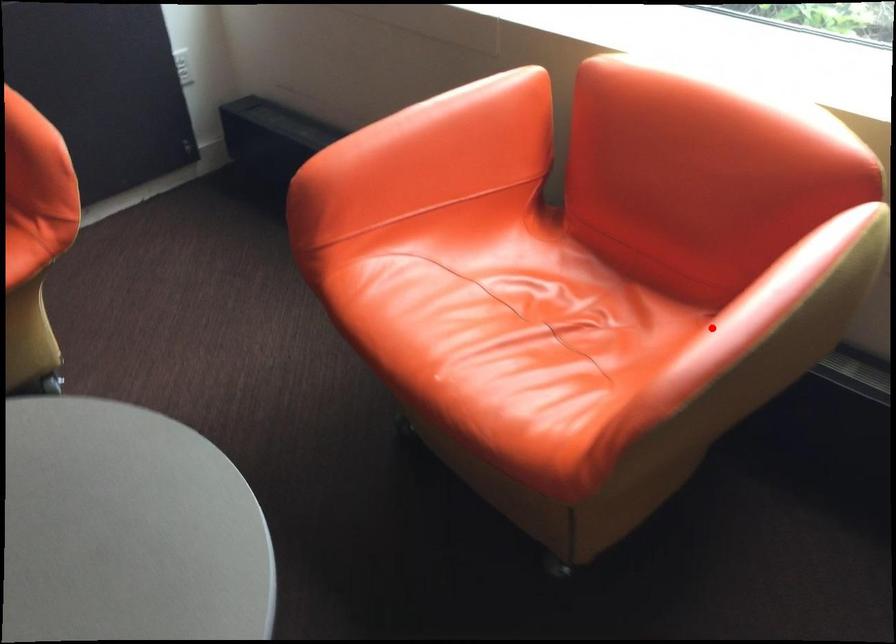
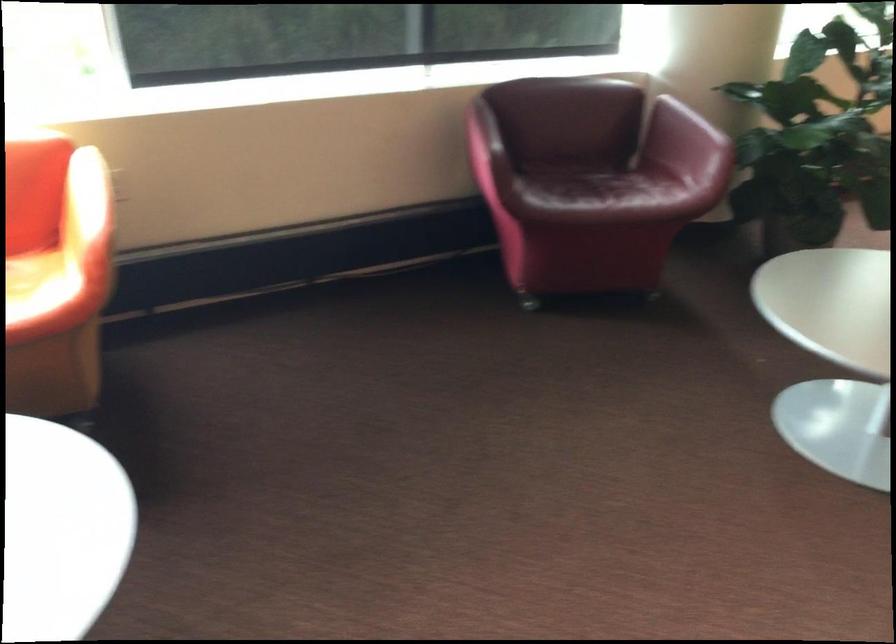
Question: I am providing you with two images of the same scene from different viewpoints. In image1, a red point is highlighted. Considering the same 3D point in image2, which of the following is correct?

Choices:
 (A) It is closer
 (B) It is farther

Answer: (B)